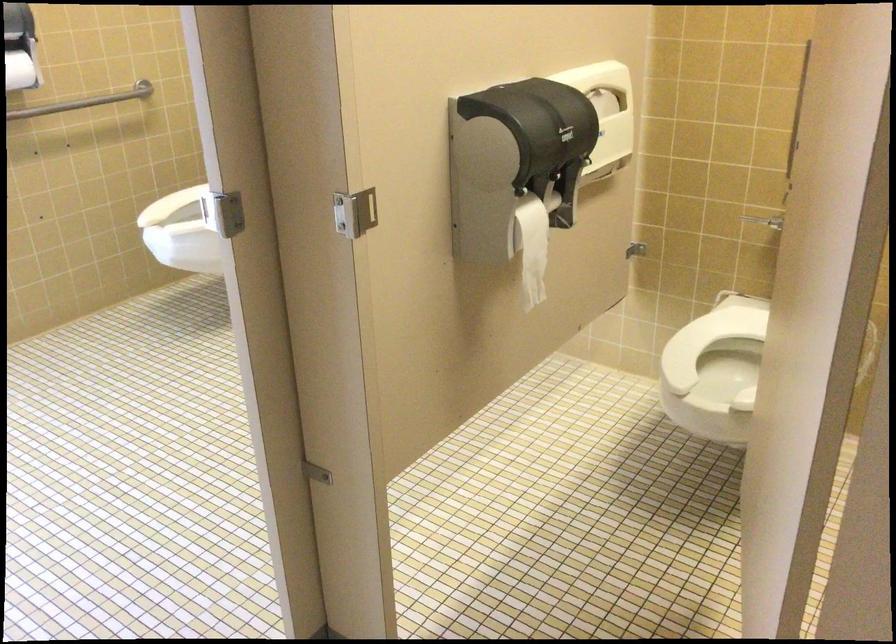
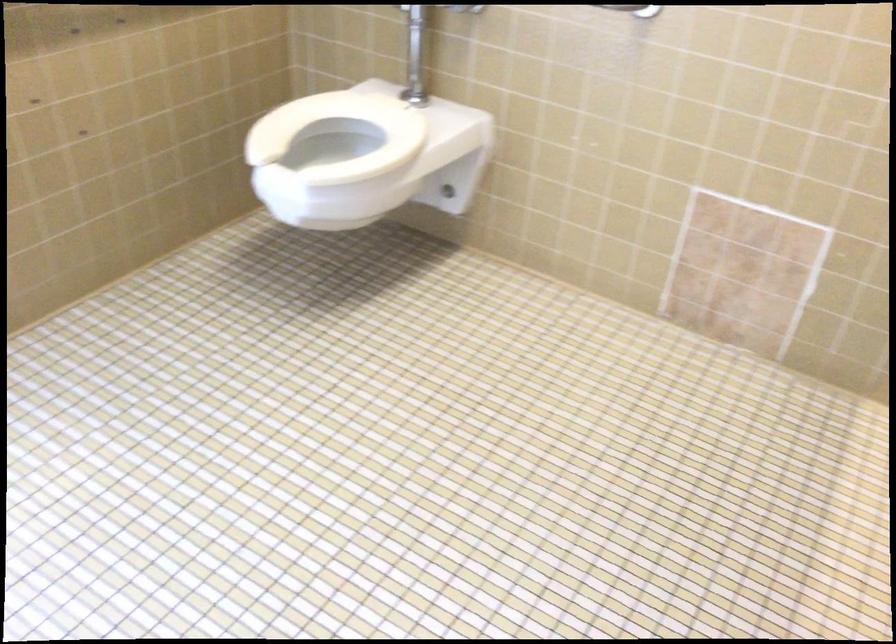
Based on the photo, which direction would the cameraman need to move to produce the second image?

The movement direction of the cameraman is left, forward.